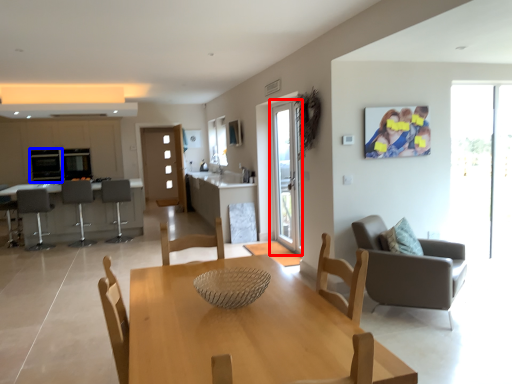
Question: Which of the following is the farthest to the observer, screen door (highlighted by a red box) or appliance (highlighted by a blue box)?

Choices:
 (A) screen door
 (B) appliance

Answer: (B)